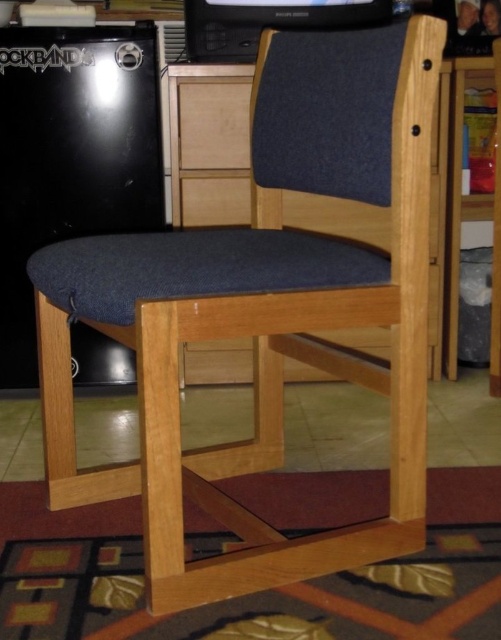
Question: Which point is closer to the camera taking this photo?

Choices:
 (A) (256, 51)
 (B) (150, 173)

Answer: (B)

Question: Is black matte mini fridge at left bigger than black plastic game console at upper center?

Choices:
 (A) no
 (B) yes

Answer: (B)

Question: Does black matte mini fridge at left appear under black plastic game console at upper center?

Choices:
 (A) no
 (B) yes

Answer: (B)

Question: Among these points, which one is nearest to the camera?

Choices:
 (A) (149, 108)
 (B) (320, 20)

Answer: (A)

Question: Among these objects, which one is nearest to the camera?

Choices:
 (A) black plastic game console at upper center
 (B) black matte mini fridge at left

Answer: (B)

Question: Is black matte mini fridge at left bigger than black plastic game console at upper center?

Choices:
 (A) no
 (B) yes

Answer: (B)